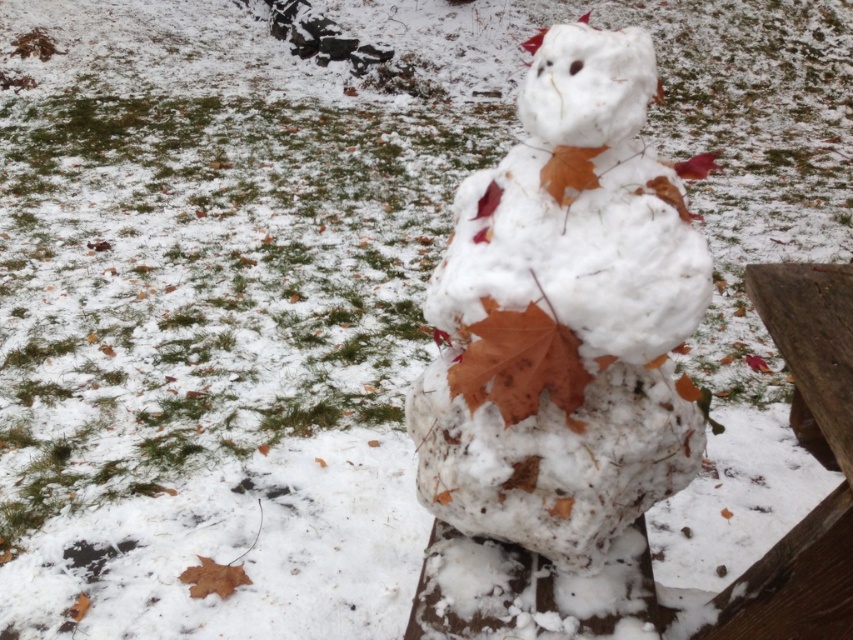
Question: Is white fluffy snowman at center to the left of wooden bench at center from the viewer's perspective?

Choices:
 (A) yes
 (B) no

Answer: (A)

Question: Which of the following is the farthest from the observer?

Choices:
 (A) (512, 202)
 (B) (808, 582)
 (C) (235, 577)

Answer: (C)

Question: Observing the image, what is the correct spatial positioning of white fluffy snowman at center in reference to brown matte leaf at lower left?

Choices:
 (A) below
 (B) above

Answer: (B)

Question: Which of the following is the farthest from the observer?

Choices:
 (A) white fluffy snowman at center
 (B) wooden bench at center
 (C) brown matte leaf at center
 (D) brown matte leaf at lower left

Answer: (D)

Question: Which point is farther to the camera?

Choices:
 (A) pos(508,381)
 (B) pos(228,588)

Answer: (B)

Question: Observing the image, what is the correct spatial positioning of white fluffy snowman at center in reference to wooden bench at center?

Choices:
 (A) left
 (B) right

Answer: (A)